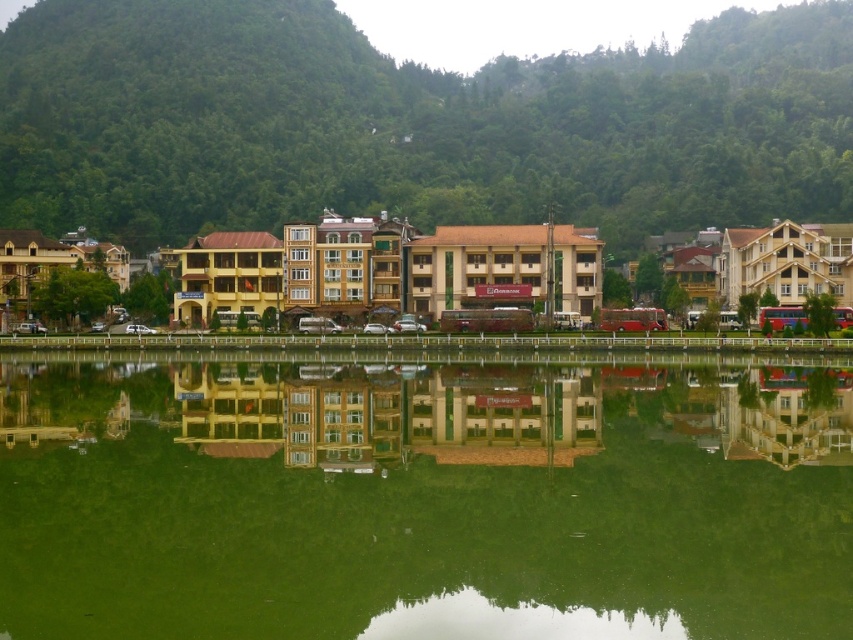
Question: Is green reflective water at center smaller than green leafy hillside at upper center?

Choices:
 (A) yes
 (B) no

Answer: (A)

Question: Which point appears farthest from the camera in this image?

Choices:
 (A) (265, 440)
 (B) (419, 129)

Answer: (B)

Question: Does green reflective water at center appear under green leafy hillside at upper center?

Choices:
 (A) yes
 (B) no

Answer: (A)

Question: Which of the following is the closest to the observer?

Choices:
 (A) green reflective water at center
 (B) green leafy hillside at upper center

Answer: (A)

Question: Is green reflective water at center below green leafy hillside at upper center?

Choices:
 (A) yes
 (B) no

Answer: (A)